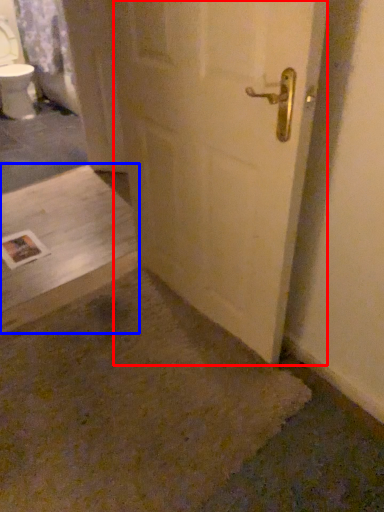
Question: Which object appears closest to the camera in this image, door (highlighted by a red box) or concrete (highlighted by a blue box)?

Choices:
 (A) door
 (B) concrete

Answer: (A)